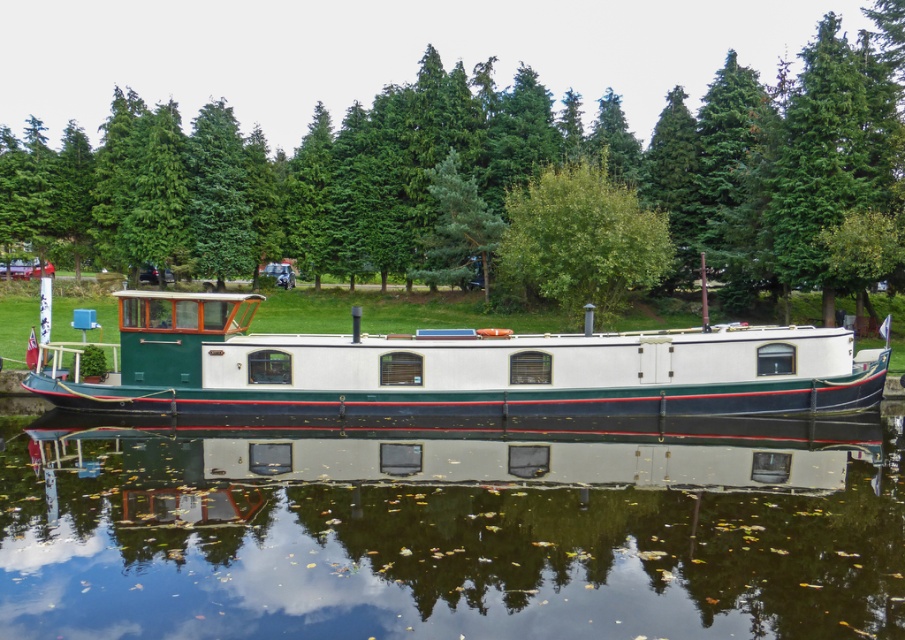
You are standing on the dock and want to check the depth of the transparent glass water at center. You have a 6.5 meter long measuring tape. Can you reach the bottom with it?

The transparent glass water at center and viewer are 6.49 meters apart. Since the measuring tape is 6.5 meters long, it is just enough to reach the bottom of the transparent glass water at center.

You are a tourist on a canal boat and want to take a photo of the transparent glass water at center and the green leafy tree at center. Which object should you focus on first if you want to capture both in one shot?

You should focus on the transparent glass water at center first because it is positioned to the left of the green leafy tree at center, so capturing the left side first ensures both objects are in frame.